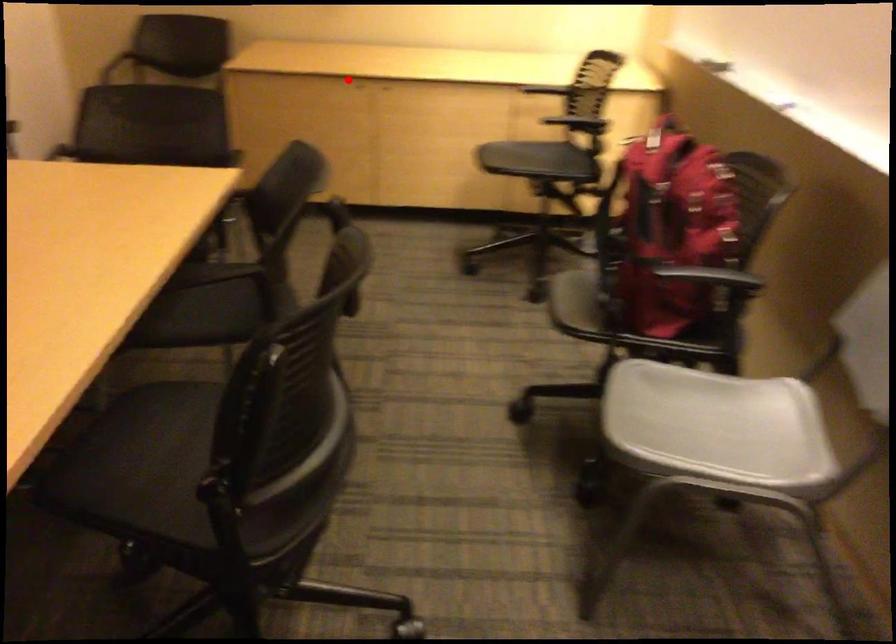
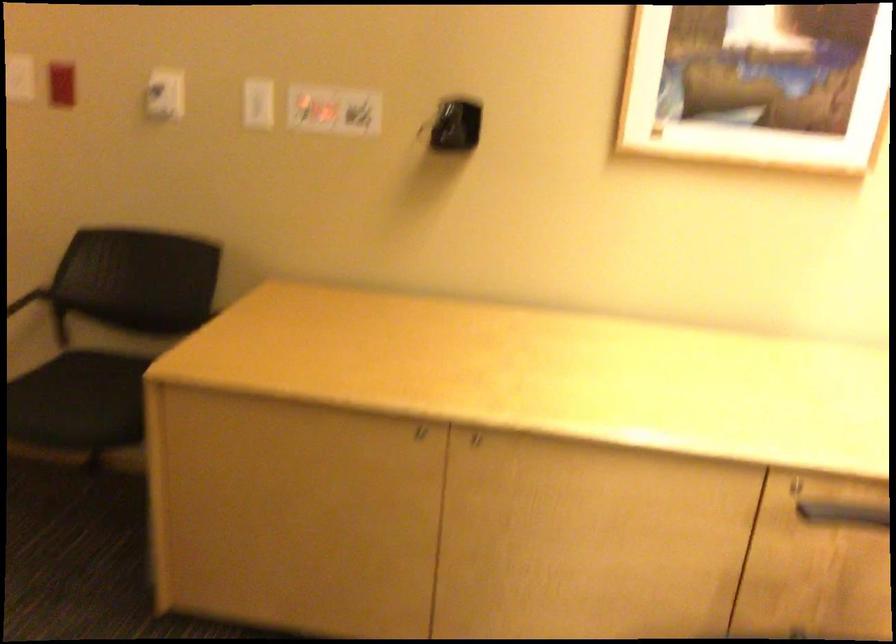
Question: I am providing you with two images of the same scene from different viewpoints. Given a red point in image1, look at the same physical point in image2. Is it:

Choices:
 (A) Closer to the viewpoint
 (B) Farther from the viewpoint

Answer: (A)